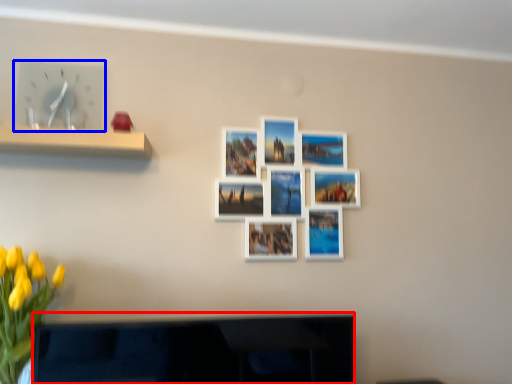
Question: Which object is further to the camera taking this photo, television (highlighted by a red box) or clock (highlighted by a blue box)?

Choices:
 (A) television
 (B) clock

Answer: (B)